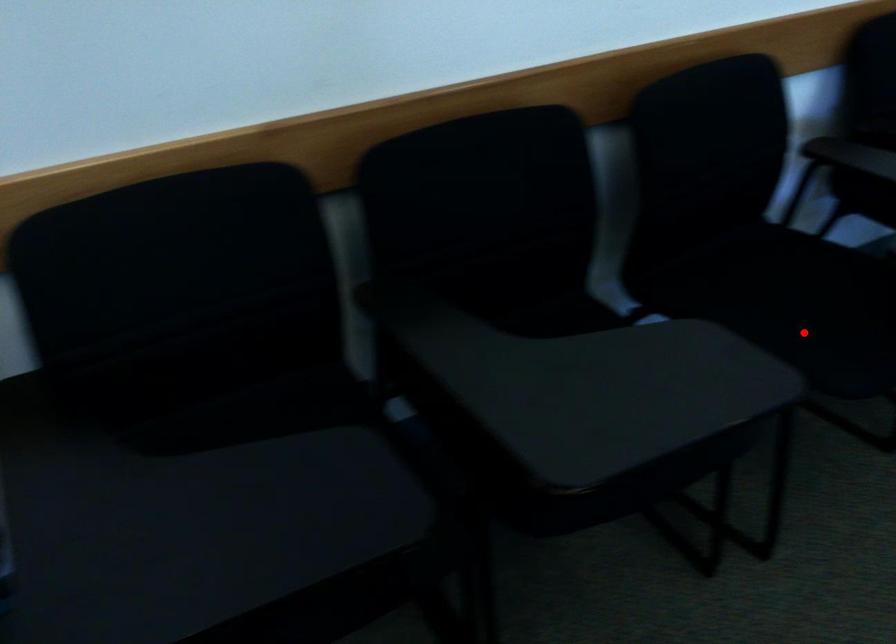
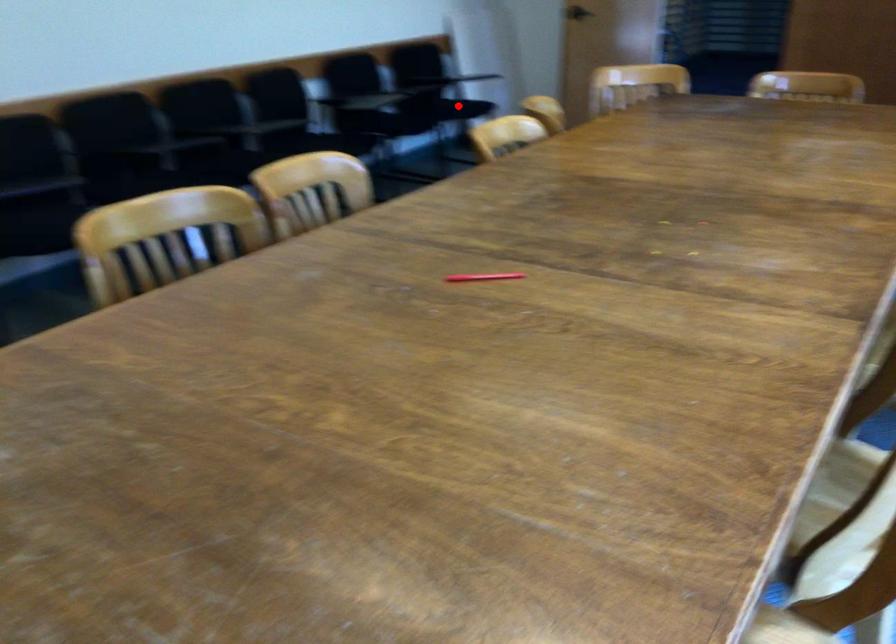
I am providing you with two images of the same scene from different viewpoints. A red point is marked on the first image and another point is marked on the second image. Do the highlighted points in image1 and image2 indicate the same real-world spot?

No